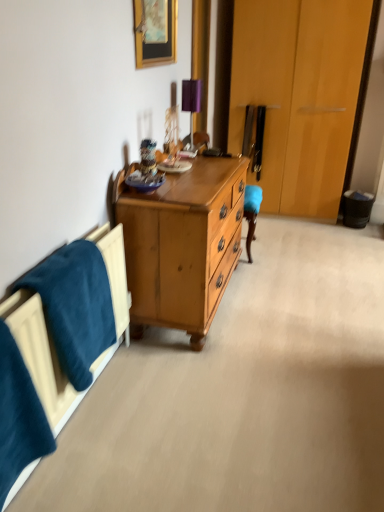
Question: Is purple fabric table lamp at upper center aimed at wooden picture frame at upper center?

Choices:
 (A) yes
 (B) no

Answer: (B)

Question: Is wooden picture frame at upper center completely or partially inside purple fabric table lamp at upper center?

Choices:
 (A) yes
 (B) no

Answer: (B)

Question: Can you confirm if purple fabric table lamp at upper center is smaller than wooden picture frame at upper center?

Choices:
 (A) yes
 (B) no

Answer: (A)

Question: From a real-world perspective, is purple fabric table lamp at upper center beneath wooden picture frame at upper center?

Choices:
 (A) no
 (B) yes

Answer: (B)

Question: From a real-world perspective, is purple fabric table lamp at upper center on wooden picture frame at upper center?

Choices:
 (A) no
 (B) yes

Answer: (A)

Question: Considering their positions, is purple fabric table lamp at upper center located in front of or behind wooden picture frame at upper center?

Choices:
 (A) behind
 (B) front

Answer: (A)

Question: Is purple fabric table lamp at upper center spatially inside wooden picture frame at upper center, or outside of it?

Choices:
 (A) inside
 (B) outside

Answer: (B)

Question: Based on their sizes in the image, would you say purple fabric table lamp at upper center is bigger or smaller than wooden picture frame at upper center?

Choices:
 (A) big
 (B) small

Answer: (B)

Question: Considering the positions of point (193, 88) and point (157, 51), is point (193, 88) closer or farther from the camera than point (157, 51)?

Choices:
 (A) closer
 (B) farther

Answer: (B)

Question: Is velvety blue blanket at lower left, which is the second blanket in front-to-back order, to the left or to the right of purple fabric table lamp at upper center in the image?

Choices:
 (A) right
 (B) left

Answer: (B)

Question: Relative to purple fabric table lamp at upper center, is velvety blue blanket at lower left, which is the second blanket in front-to-back order, in front or behind?

Choices:
 (A) front
 (B) behind

Answer: (A)

Question: In terms of size, does velvety blue blanket at lower left, arranged as the first blanket when viewed from the back, appear bigger or smaller than purple fabric table lamp at upper center?

Choices:
 (A) small
 (B) big

Answer: (B)

Question: Is velvety blue blanket at lower left, arranged as the first blanket when viewed from the back, situated inside purple fabric table lamp at upper center or outside?

Choices:
 (A) inside
 (B) outside

Answer: (B)

Question: Visually, is velvety blue blanket at lower left, which is the second blanket in front-to-back order, positioned to the left or to the right of wooden picture frame at upper center?

Choices:
 (A) left
 (B) right

Answer: (A)

Question: Is velvety blue blanket at lower left, which is the second blanket in front-to-back order, inside or outside of wooden picture frame at upper center?

Choices:
 (A) inside
 (B) outside

Answer: (B)